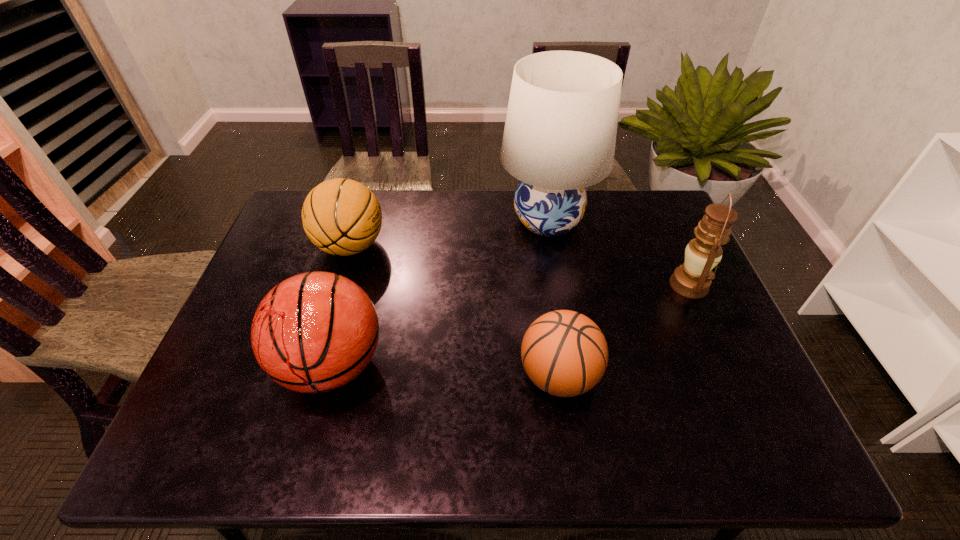
This screenshot has height=540, width=960. Find the location of `vacant space that satisfies the following two spatial constraints: 1. on the front-facing side of the tallest object; 2. on the back side of the rightmost object`. vacant space that satisfies the following two spatial constraints: 1. on the front-facing side of the tallest object; 2. on the back side of the rightmost object is located at coordinates (559, 286).

The width and height of the screenshot is (960, 540). Identify the location of blank area in the image that satisfies the following two spatial constraints: 1. on the surface of the second shortest object near the brand logo; 2. on the right side of the oil lamp. click(x=339, y=286).

The width and height of the screenshot is (960, 540). I want to click on blank area in the image that satisfies the following two spatial constraints: 1. on the side with spill of the rightmost basketball; 2. on the left side of the tallest basketball, so click(329, 375).

Locate an element on the screen. vacant area that satisfies the following two spatial constraints: 1. on the side with spill of the rightmost basketball; 2. on the left side of the tallest basketball is located at coordinates (329, 375).

You are a GUI agent. You are given a task and a screenshot of the screen. Output one action in this format:
    pyautogui.click(x=<x>, y=<y>)
    Task: Click on the free space that satisfies the following two spatial constraints: 1. on the front-facing side of the lampshade; 2. on the side with spill of the tallest basketball
    
    Given the screenshot: What is the action you would take?
    pyautogui.click(x=572, y=364)